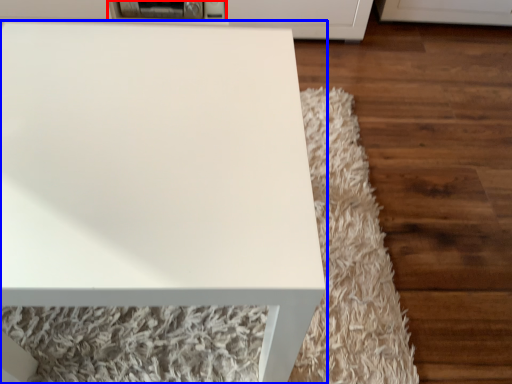
Question: Which point is closer to the camera, appliance (highlighted by a red box) or table (highlighted by a blue box)?

Choices:
 (A) appliance
 (B) table

Answer: (B)